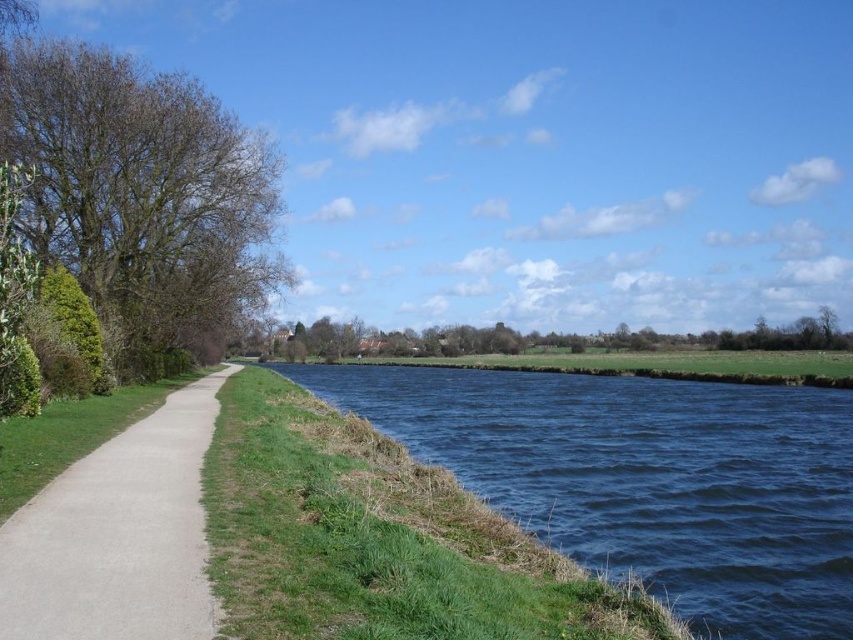
You are standing on the riverside pathway and want to take a photo of the blue water at center and the green leafy tree at center. Which object will appear closer to the camera in the photo?

The blue water at center appears closer to the camera in the photo because it is positioned in front of the green leafy tree at center.

You are standing on the riverside pathway and want to take a photo of both the blue water at center and the green leafy tree at center. Which object should you position closer to the left side of your camera frame to include both in your shot?

You should position the blue water at center closer to the left side of your camera frame since it is already to the left of the green leafy tree at center.